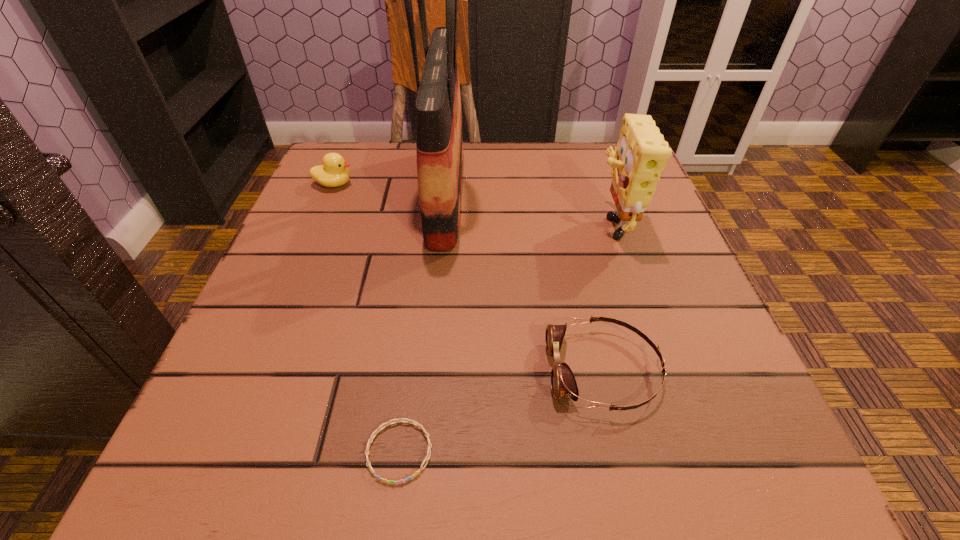
This screenshot has height=540, width=960. In order to click on free space between the leftmost object and the shortest object in this screenshot , I will do `click(367, 318)`.

I want to click on free point between the sponge and the second shortest object, so click(607, 296).

Locate an element on the screen. This screenshot has width=960, height=540. object identified as the fourth closest to the fourth tallest object is located at coordinates (333, 173).

Where is `the third closest object to the sponge`? the third closest object to the sponge is located at coordinates (413, 422).

Identify the location of vacant space that satisfies the following two spatial constraints: 1. on the face of the second tallest object; 2. on the surface of the shortest object showing star-shaped elements. The width and height of the screenshot is (960, 540). (687, 451).

At what (x,y) coordinates should I click in order to perform the action: click on free space that satisfies the following two spatial constraints: 1. through the lenses of the fourth farthest object; 2. on the surface of the shortest object showing star-shaped elements. Please return your answer as a coordinate pair (x, y). Image resolution: width=960 pixels, height=540 pixels. Looking at the image, I should click on (622, 451).

Image resolution: width=960 pixels, height=540 pixels. Find the location of `free space that satisfies the following two spatial constraints: 1. on the face of the sponge; 2. on the surface of the nearest object showing star-shaped elements`. free space that satisfies the following two spatial constraints: 1. on the face of the sponge; 2. on the surface of the nearest object showing star-shaped elements is located at coordinates (687, 451).

You are a GUI agent. You are given a task and a screenshot of the screen. Output one action in this format:
    pyautogui.click(x=<x>, y=<y>)
    Task: Click on the free location that satisfies the following two spatial constraints: 1. on the front-facing side of the shopping bag; 2. on the surface of the bracelet showing star-shaped elements
    The image size is (960, 540).
    Given the screenshot: What is the action you would take?
    pyautogui.click(x=421, y=451)

This screenshot has width=960, height=540. I want to click on free space that satisfies the following two spatial constraints: 1. through the lenses of the second shortest object; 2. on the surface of the nearest object showing star-shaped elements, so (x=622, y=451).